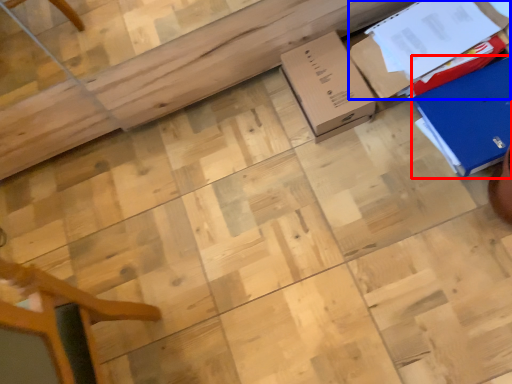
Question: Which object is further to the camera taking this photo, cardboard box (highlighted by a red box) or cardboard box (highlighted by a blue box)?

Choices:
 (A) cardboard box
 (B) cardboard box

Answer: (B)